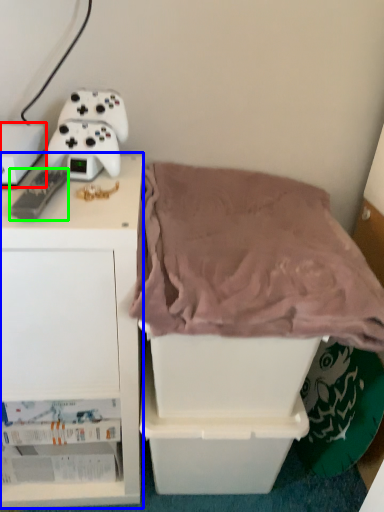
Question: Which object is the closest to the storage box (highlighted by a red box)? Choose among these: furniture (highlighted by a blue box) or game controller (highlighted by a green box).

Choices:
 (A) furniture
 (B) game controller

Answer: (B)